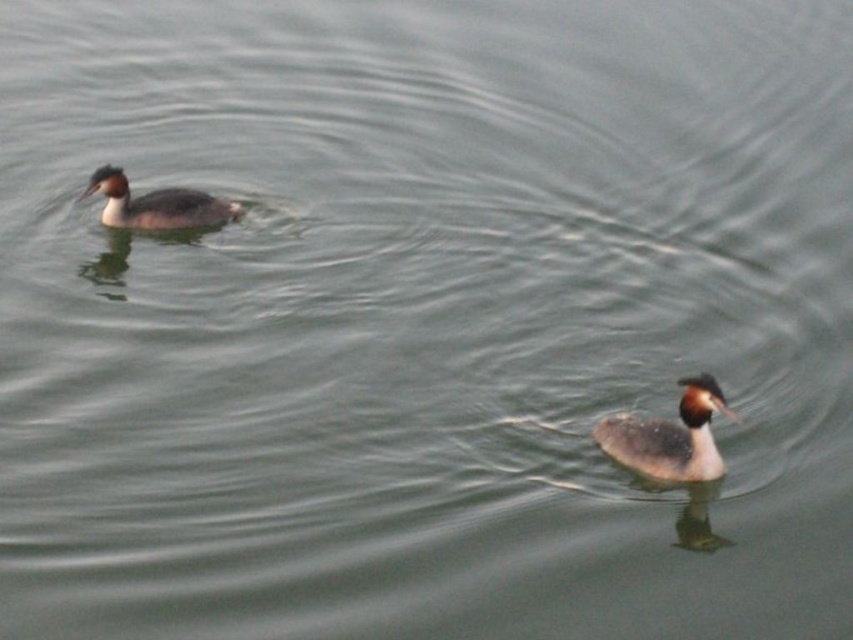
Does point (601, 428) lie in front of point (126, 209)?

Yes, point (601, 428) is closer to viewer.

Between gray speckled duck at lower right and gray matte duck at upper left, which one has more height?

gray speckled duck at lower right is taller.

Describe the element at coordinates (670, 436) in the screenshot. The image size is (853, 640). I see `gray speckled duck at lower right` at that location.

Where is `gray speckled duck at lower right`? The height and width of the screenshot is (640, 853). gray speckled duck at lower right is located at coordinates (670, 436).